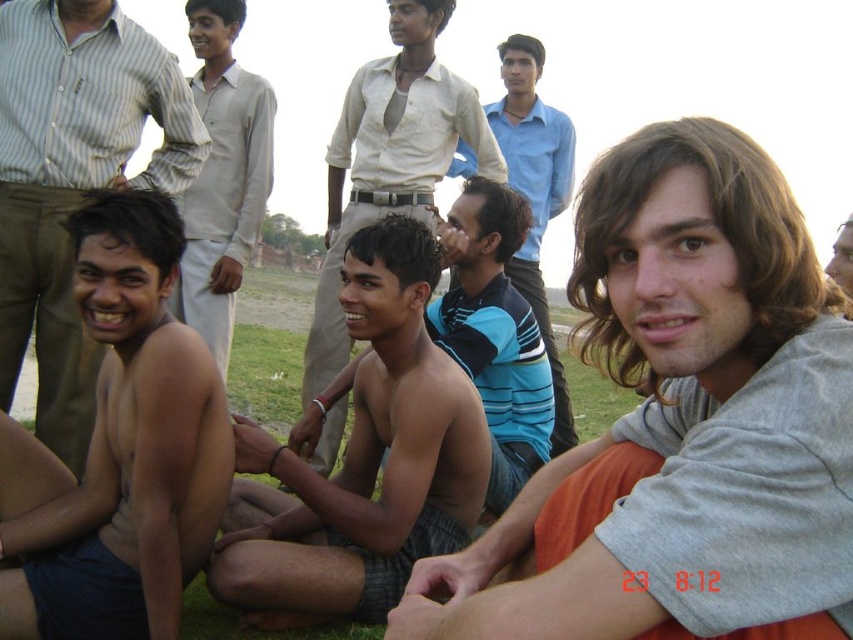
Does smooth skin man at center have a larger size compared to blue striped shirt at center?

Actually, smooth skin man at center might be smaller than blue striped shirt at center.

Find the location of `smooth skin man at center`. smooth skin man at center is located at coordinates (386, 182).

Identify the location of smooth skin man at center. (386, 182).

Can you confirm if shiny skin at lower left is bigger than smooth skin man at center?

No, shiny skin at lower left is not bigger than smooth skin man at center.

Between point (93, 58) and point (325, 410), which one is positioned behind?

The point (325, 410) is more distant.

The height and width of the screenshot is (640, 853). In order to click on shiny skin at lower left in this screenshot , I will do `click(73, 180)`.

Does shiny skin torso at center have a lesser width compared to shiny skin boy at center?

Incorrect, shiny skin torso at center's width is not less than shiny skin boy at center's.

Which is behind, point (91, 333) or point (364, 566)?

The point (364, 566) is more distant.

Is point (19, 625) positioned behind point (357, 276)?

No, (19, 625) is in front of (357, 276).

The width and height of the screenshot is (853, 640). I want to click on shiny skin torso at center, so click(x=126, y=448).